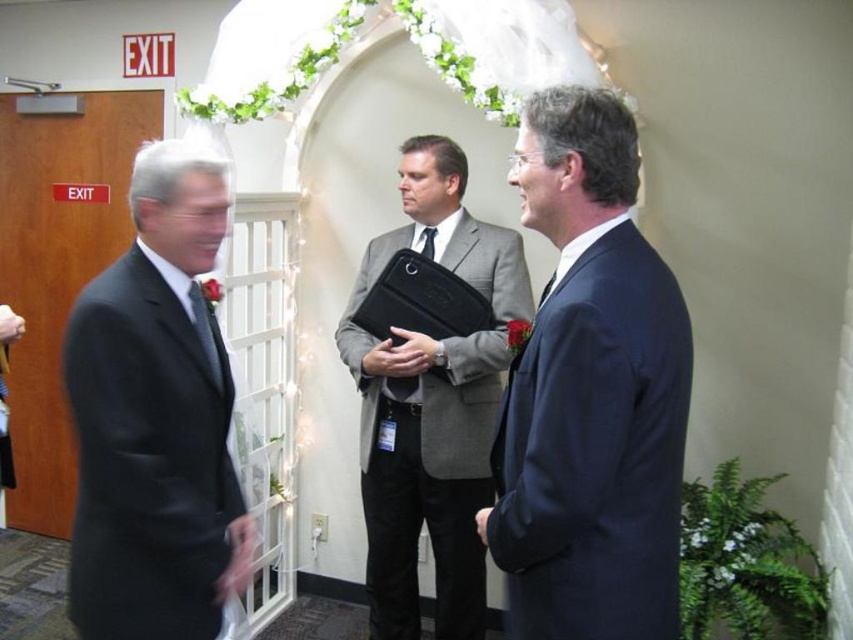
Question: Is gray wool suit at center bigger than black silk tie at center?

Choices:
 (A) no
 (B) yes

Answer: (B)

Question: Is navy blue suit at center bigger than gray wool suit at center?

Choices:
 (A) no
 (B) yes

Answer: (A)

Question: Which object is positioned closest to the matte black tie at left?

Choices:
 (A) gray wool suit at center
 (B) black silk tie at center

Answer: (A)

Question: Which point appears closest to the camera in this image?

Choices:
 (A) (685, 324)
 (B) (431, 256)
 (C) (67, 372)
 (D) (198, 312)

Answer: (A)

Question: Does navy blue suit at center come in front of matte black suit at left?

Choices:
 (A) no
 (B) yes

Answer: (B)

Question: Among these points, which one is farthest from the camera?

Choices:
 (A) click(202, 392)
 (B) click(213, 349)

Answer: (B)